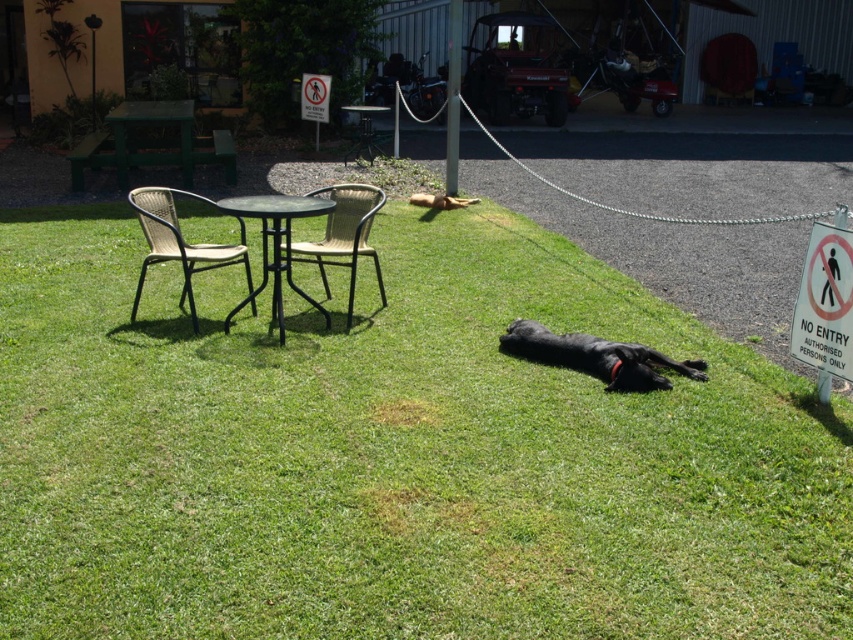
Question: Does no entry sign at center right appear over white plastic sign at upper center?

Choices:
 (A) no
 (B) yes

Answer: (A)

Question: From the image, what is the correct spatial relationship of no entry sign at center right in relation to white plastic sign at upper center?

Choices:
 (A) below
 (B) above

Answer: (A)

Question: Estimate the real-world distances between objects in this image. Which object is closer to the green grass at center?

Choices:
 (A) no entry sign at center right
 (B) white plastic sign at upper center
 (C) black metal table at center
 (D) green plastic table at center

Answer: (A)

Question: From the image, what is the correct spatial relationship of black smooth dog at center in relation to woven wicker chair at center?

Choices:
 (A) below
 (B) above

Answer: (A)

Question: Which point is closer to the camera taking this photo?

Choices:
 (A) (270, 196)
 (B) (363, 118)
 (C) (190, 163)

Answer: (A)

Question: Among these objects, which one is nearest to the camera?

Choices:
 (A) white plastic sign at upper center
 (B) green plastic table at upper left

Answer: (B)